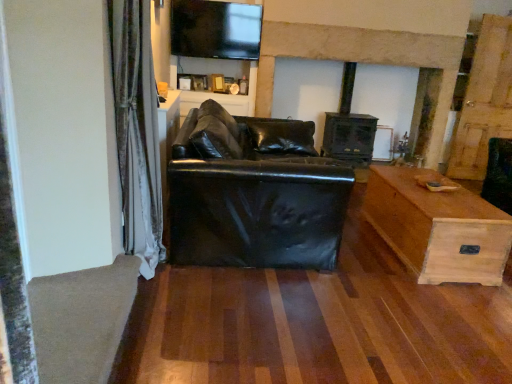
Where is `wooden chest at right`? wooden chest at right is located at coordinates (438, 227).

Does velvet curtain at left contain wooden chest at right?

Definitely not — wooden chest at right is not inside velvet curtain at left.

Is point (120, 89) closer or farther from the camera than point (391, 196)?

Point (120, 89).

From the image's perspective, would you say velvet curtain at left is positioned over wooden chest at right?

Correct, velvet curtain at left appears higher than wooden chest at right in the image.

In terms of width, does velvet curtain at left look wider or thinner when compared to wooden chest at right?

In the image, velvet curtain at left appears to be more narrow than wooden chest at right.

Based on the photo, considering the relative sizes of black leather couch at center and velvet curtain at left in the image provided, is black leather couch at center smaller than velvet curtain at left?

Incorrect, black leather couch at center is not smaller in size than velvet curtain at left.

From a real-world perspective, is black leather couch at center physically below velvet curtain at left?

Yes.

Is black leather couch at center not within velvet curtain at left?

Yes, black leather couch at center is not within velvet curtain at left.

Can you tell me how much black leather couch at center and velvet curtain at left differ in facing direction?

The facing directions of black leather couch at center and velvet curtain at left are 0.586 degrees apart.

Does black leather couch at center have a greater height compared to wooden chest at right?

Yes, black leather couch at center is taller than wooden chest at right.

Is black leather couch at center inside or outside of wooden chest at right?

black leather couch at center cannot be found inside wooden chest at right.

Is black leather couch at center facing away from wooden chest at right?

No, black leather couch at center's orientation is not away from wooden chest at right.

Is point (224, 196) closer or farther from the camera than point (454, 263)?

Point (224, 196) appears to be closer to the viewer than point (454, 263).

From the image's perspective, who appears lower, velvet curtain at left or black leather couch at center?

From the image's view, black leather couch at center is below.

Based on the photo, between velvet curtain at left and black leather couch at center, which one has more height?

velvet curtain at left.

Considering the relative sizes of velvet curtain at left and black leather couch at center in the image provided, is velvet curtain at left smaller than black leather couch at center?

Indeed, velvet curtain at left has a smaller size compared to black leather couch at center.

Is wooden chest at right aimed at black leather couch at center?

Yes, wooden chest at right is turned towards black leather couch at center.

This screenshot has height=384, width=512. In order to click on studio couch located on the left of wooden chest at right in this screenshot , I will do `click(254, 193)`.

Looking at their sizes, would you say wooden chest at right is wider or thinner than black leather couch at center?

Considering their sizes, wooden chest at right looks slimmer than black leather couch at center.

Considering the sizes of matte black entertainment center at upper center and wooden chest at right in the image, is matte black entertainment center at upper center wider or thinner than wooden chest at right?

In the image, matte black entertainment center at upper center appears to be more narrow than wooden chest at right.

How far apart are matte black entertainment center at upper center and wooden chest at right?

matte black entertainment center at upper center and wooden chest at right are 2.29 meters apart.

From a real-world perspective, is matte black entertainment center at upper center positioned above or below wooden chest at right?

matte black entertainment center at upper center is above wooden chest at right.

From their relative heights in the image, would you say matte black entertainment center at upper center is taller or shorter than wooden chest at right?

In the image, matte black entertainment center at upper center appears to be taller than wooden chest at right.

Could you tell me if dark wood fireplace at center is facing black leather couch at center?

Yes, dark wood fireplace at center faces towards black leather couch at center.

Considering the positions of point (446, 114) and point (237, 203), is point (446, 114) closer or farther from the camera than point (237, 203)?

Point (446, 114).

Choose the correct answer: Is dark wood fireplace at center inside black leather couch at center or outside it?

dark wood fireplace at center exists outside the volume of black leather couch at center.

Find the location of `curtain to the left of wooden chest at right`. curtain to the left of wooden chest at right is located at coordinates (137, 131).

Locate an element on the screen. The image size is (512, 384). studio couch on the right side of velvet curtain at left is located at coordinates (254, 193).

From the image, which object appears to be farther from velvet curtain at left, wooden chest at right or matte black entertainment center at upper center?

The object further to velvet curtain at left is matte black entertainment center at upper center.

Looking at the image, which one is located further to matte black entertainment center at upper center, wooden chest at right or dark wood fireplace at center?

wooden chest at right is further to matte black entertainment center at upper center.

Looking at the image, which one is located closer to matte black entertainment center at upper center, dark wood fireplace at center or wooden chest at right?

Based on the image, dark wood fireplace at center appears to be nearer to matte black entertainment center at upper center.

From the picture: Estimate the real-world distances between objects in this image. Which object is further from matte black entertainment center at upper center, black leather couch at center or velvet curtain at left?

velvet curtain at left lies further to matte black entertainment center at upper center than the other object.

When comparing their distances from dark wood fireplace at center, does black leather couch at center or wooden chest at right seem closer?

Among the two, wooden chest at right is located nearer to dark wood fireplace at center.

Considering their positions, is matte black entertainment center at upper center positioned closer to dark wood fireplace at center than velvet curtain at left?

Based on the image, matte black entertainment center at upper center appears to be nearer to dark wood fireplace at center.

Which object lies nearer to the anchor point velvet curtain at left, matte black entertainment center at upper center or black leather couch at center?

The object closer to velvet curtain at left is black leather couch at center.

Looking at the image, which one is located further to dark wood fireplace at center, velvet curtain at left or matte black entertainment center at upper center?

velvet curtain at left lies further to dark wood fireplace at center than the other object.

Locate an element on the screen. The height and width of the screenshot is (384, 512). table between black leather couch at center and dark wood fireplace at center from front to back is located at coordinates (438, 227).

The height and width of the screenshot is (384, 512). I want to click on fireplace between wooden chest at right and matte black entertainment center at upper center from front to back, so click(x=362, y=60).

Locate an element on the screen. fireplace between black leather couch at center and matte black entertainment center at upper center along the z-axis is located at coordinates (362, 60).

At what (x,y) coordinates should I click in order to perform the action: click on fireplace positioned between velvet curtain at left and matte black entertainment center at upper center from near to far. Please return your answer as a coordinate pair (x, y). This screenshot has width=512, height=384. Looking at the image, I should click on (362, 60).